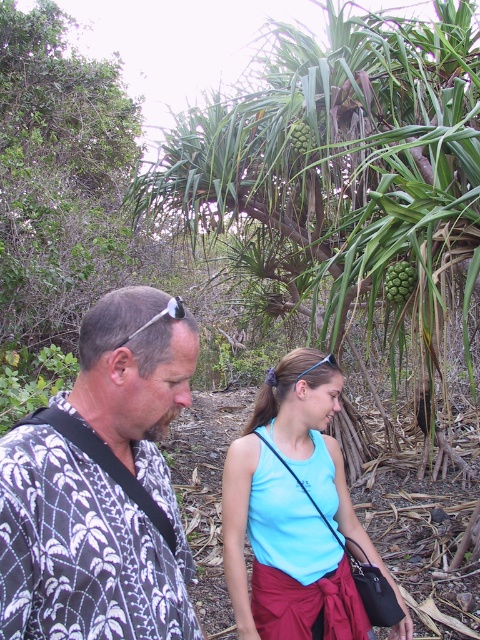
You are standing at point (348, 180) in the image. What object is located exactly at your current position?

The green leafy tree at center is located exactly at point (348, 180).

Based on the photo, you are a hiker who wants to take a photo of the green leafy tree at center. Where should you stand to capture it in the frame?

The green leafy tree at center is located at point (348,180), so you should position yourself facing that coordinate to capture it in the frame.